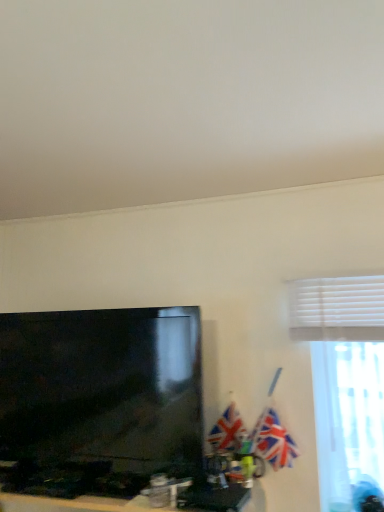
Question: Can union jack flag at right, the second flag from the left, be found inside textured fabric flag at center, the 2th flag viewed from the right?

Choices:
 (A) no
 (B) yes

Answer: (A)

Question: Is textured fabric flag at center, arranged as the first flag when viewed from the left, located outside union jack flag at right, marked as the first flag in a right-to-left arrangement?

Choices:
 (A) yes
 (B) no

Answer: (A)

Question: From the image's perspective, is textured fabric flag at center, the 2th flag viewed from the right, under union jack flag at right, the second flag from the left?

Choices:
 (A) yes
 (B) no

Answer: (A)

Question: Is textured fabric flag at center, arranged as the first flag when viewed from the left, shorter than union jack flag at right, marked as the first flag in a right-to-left arrangement?

Choices:
 (A) yes
 (B) no

Answer: (B)

Question: Considering the relative sizes of textured fabric flag at center, the 2th flag viewed from the right, and union jack flag at right, marked as the first flag in a right-to-left arrangement, in the image provided, is textured fabric flag at center, the 2th flag viewed from the right, bigger than union jack flag at right, marked as the first flag in a right-to-left arrangement,?

Choices:
 (A) no
 (B) yes

Answer: (A)

Question: Does point (233, 435) appear closer or farther from the camera than point (253, 438)?

Choices:
 (A) closer
 (B) farther

Answer: (B)

Question: In terms of width, does textured fabric flag at center, arranged as the first flag when viewed from the left, look wider or thinner when compared to blue glossy flag pole at upper right?

Choices:
 (A) thin
 (B) wide

Answer: (A)

Question: In terms of height, does textured fabric flag at center, arranged as the first flag when viewed from the left, look taller or shorter compared to blue glossy flag pole at upper right?

Choices:
 (A) short
 (B) tall

Answer: (A)

Question: Is textured fabric flag at center, arranged as the first flag when viewed from the left, situated inside blue glossy flag pole at upper right or outside?

Choices:
 (A) inside
 (B) outside

Answer: (B)

Question: Considering the positions of blue glossy flag pole at upper right and union jack flag at right, the second flag from the left, in the image, is blue glossy flag pole at upper right wider or thinner than union jack flag at right, the second flag from the left,?

Choices:
 (A) wide
 (B) thin

Answer: (A)

Question: Is point (261, 413) closer or farther from the camera than point (266, 439)?

Choices:
 (A) closer
 (B) farther

Answer: (B)

Question: Looking at the image, does blue glossy flag pole at upper right seem bigger or smaller compared to union jack flag at right, marked as the first flag in a right-to-left arrangement?

Choices:
 (A) big
 (B) small

Answer: (B)

Question: In the image, is blue glossy flag pole at upper right on the left side or the right side of union jack flag at right, the second flag from the left?

Choices:
 (A) left
 (B) right

Answer: (A)

Question: Does point (367, 371) appear closer or farther from the camera than point (77, 477)?

Choices:
 (A) closer
 (B) farther

Answer: (B)

Question: Looking at the image, does white blinds at upper right seem bigger or smaller compared to matte black tv at lower left?

Choices:
 (A) small
 (B) big

Answer: (A)